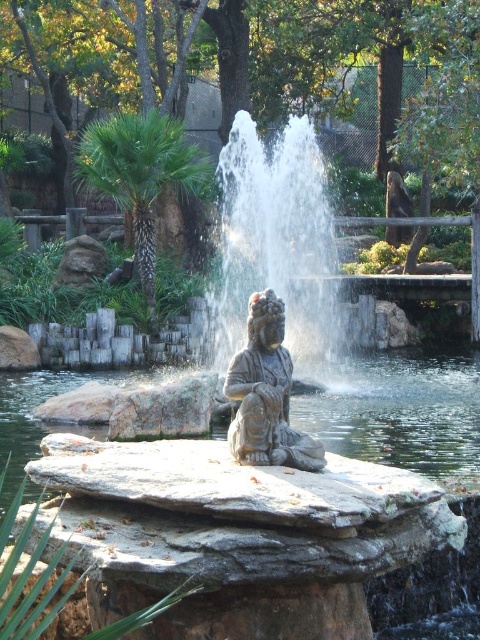
You are planning to place a new decorative item in the outdoor area. The item is 1 meter in height. Given the gray stone water at center and the matte stone statue at center, which object would you choose to place the item next to, and why?

The gray stone water at center has a larger size compared to the matte stone statue at center. Therefore, placing the 1 meter tall decorative item next to the gray stone water at center would provide a better proportional balance due to its larger size.

You are a landscape architect designing a new garden. You need to place a new decorative pot that is 1 meter in diameter. Given the slate gray stone fountain at center and the matte stone statue at center, which object should you place the pot next to if you want it to be proportionally balanced with the existing structures?

The slate gray stone fountain at center has a larger size compared to the matte stone statue at center. To achieve proportional balance, the decorative pot should be placed next to the slate gray stone fountain at center since it is larger and can accommodate the pot of 1 meter diameter more harmoniously.